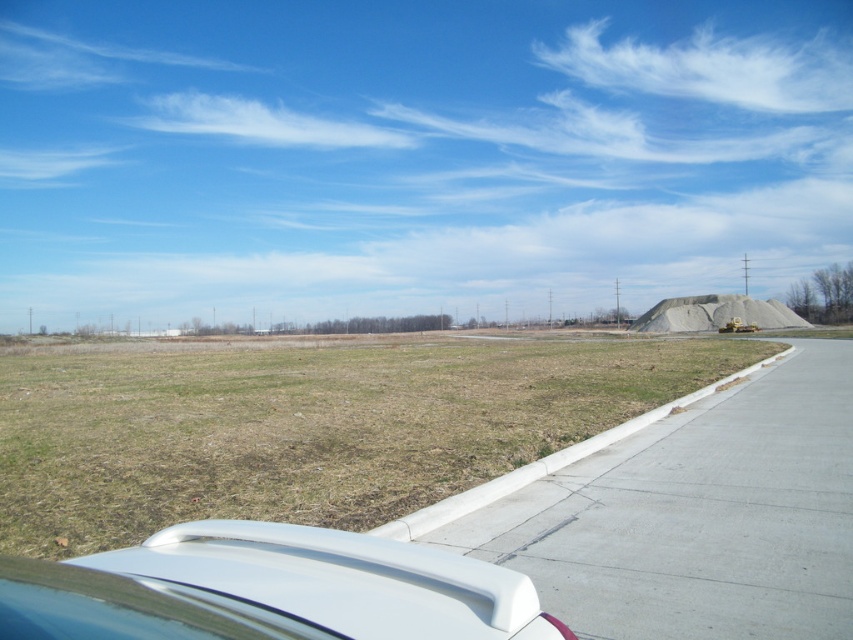
Which is below, green grass at lower left or white matte spoiler at lower center?

→ green grass at lower left is lower down.

The image size is (853, 640). In order to click on green grass at lower left in this screenshot , I will do `click(305, 428)`.

Find the location of `green grass at lower left`. green grass at lower left is located at coordinates (305, 428).

Based on the photo, does concrete at right have a greater height compared to gray gravel pile at right?

No.

Find the location of a particular element. The height and width of the screenshot is (640, 853). concrete at right is located at coordinates (543, 465).

This screenshot has width=853, height=640. I want to click on concrete at right, so click(543, 465).

Between point (438, 612) and point (724, 312), which one is positioned behind?

The point (724, 312) is behind.

In the scene shown: Is white matte spoiler at lower center closer to the viewer compared to gray gravel pile at right?

Yes, white matte spoiler at lower center is in front of gray gravel pile at right.

Does point (190, 593) come farther from viewer compared to point (709, 305)?

No.

Locate an element on the screen. The width and height of the screenshot is (853, 640). white matte spoiler at lower center is located at coordinates (270, 589).